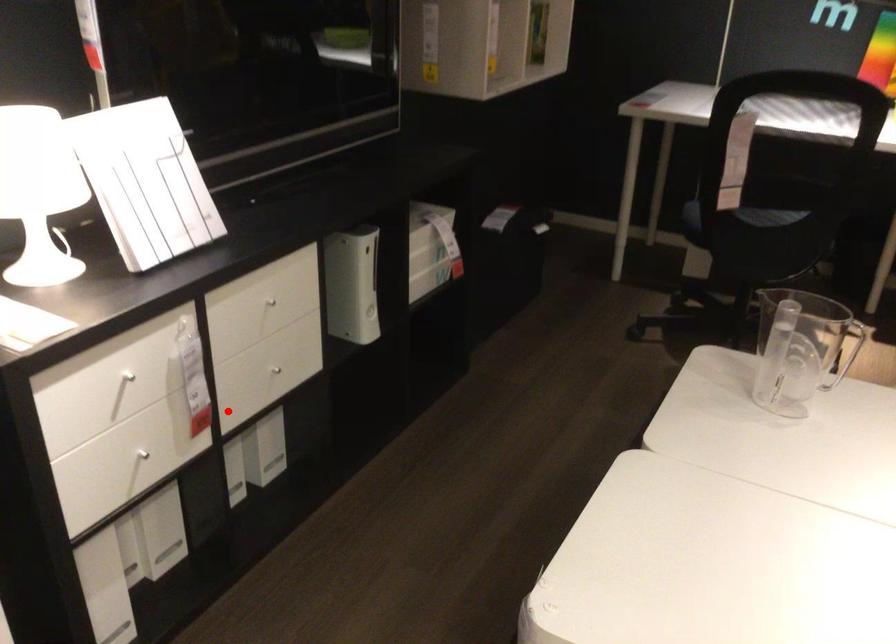
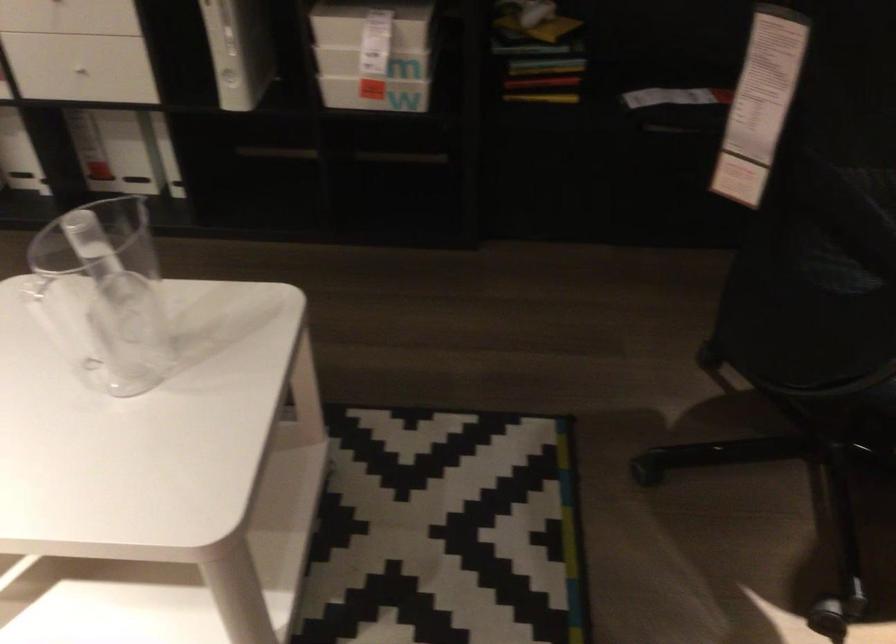
Locate, in the second image, the point that corresponds to the highlighted location in the first image.

(75, 77)